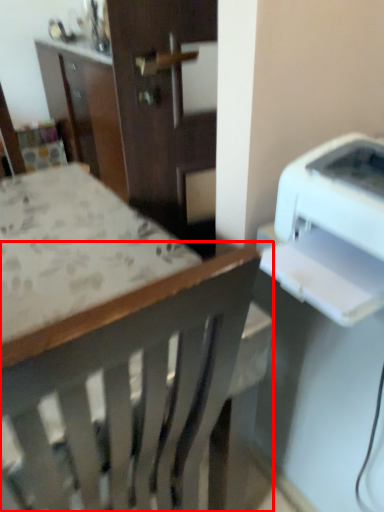
Question: From the image's perspective, what is the correct spatial relationship of chair (annotated by the red box) in relation to printer?

Choices:
 (A) above
 (B) below

Answer: (B)